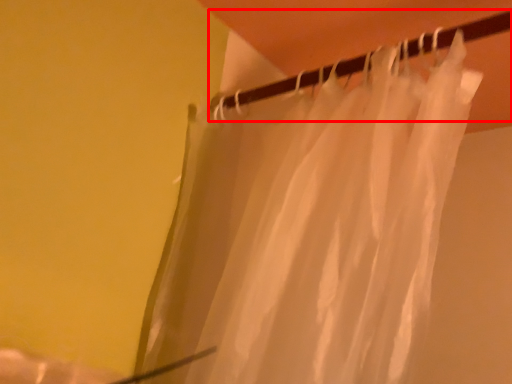
Question: From the image's perspective, where is clothesline (annotated by the red box) located in relation to curtain in the image?

Choices:
 (A) above
 (B) below

Answer: (A)